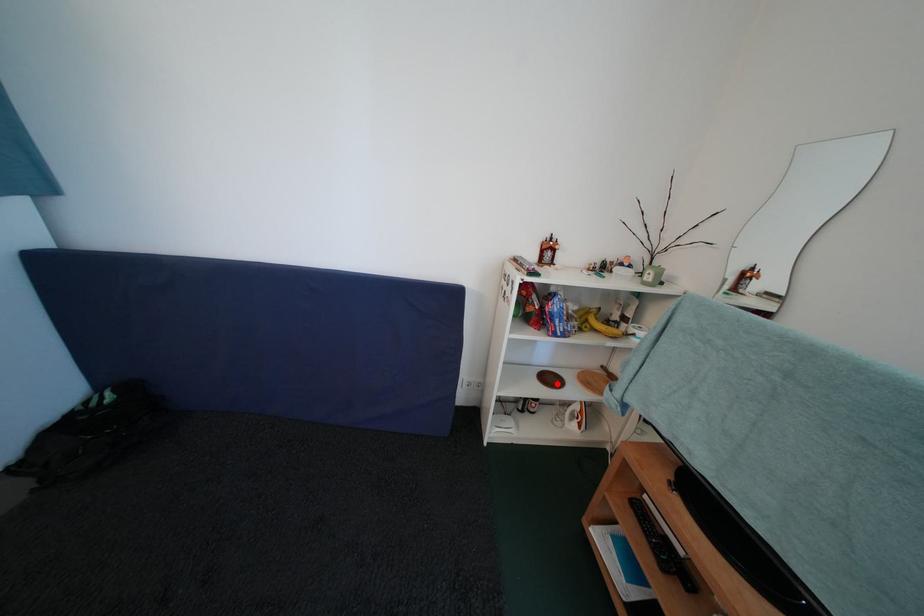
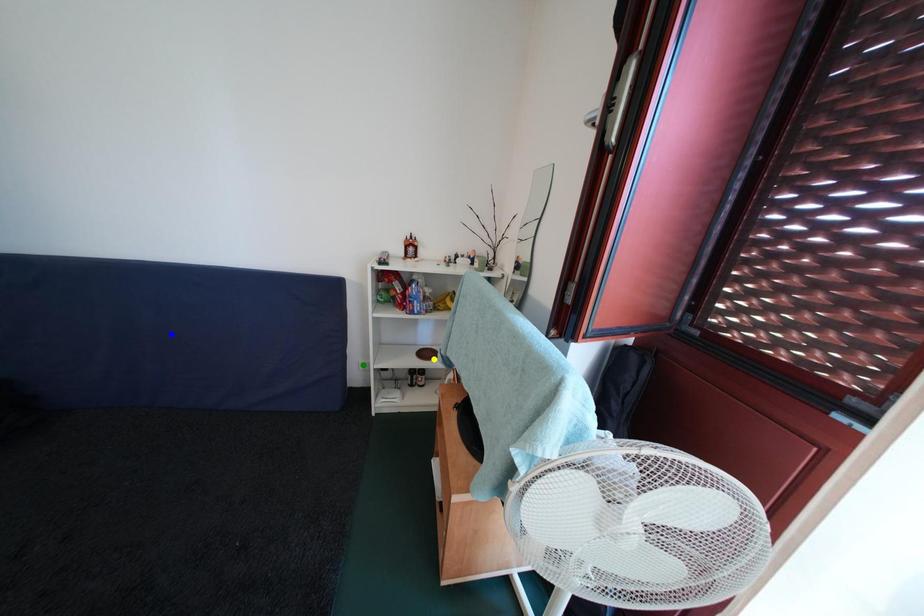
Question: I am providing you with two images of the same scene from different viewpoints. A red point is marked on the first image. You are given multiple points on the second image. Which spot in image 2 lines up with the point in image 1?

Choices:
 (A) green point
 (B) blue point
 (C) yellow point

Answer: (C)